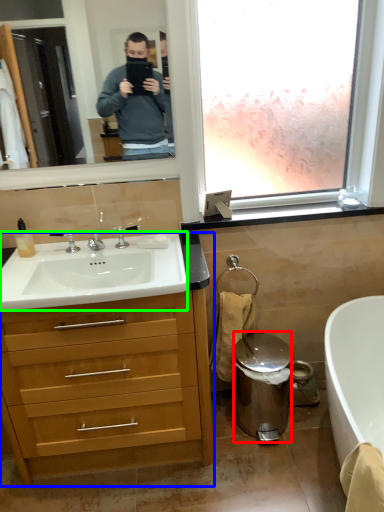
Question: Which object is positioned closest to trash bin/can (highlighted by a red box)? Select from cabinetry (highlighted by a blue box) and sink (highlighted by a green box).

Choices:
 (A) cabinetry
 (B) sink

Answer: (A)